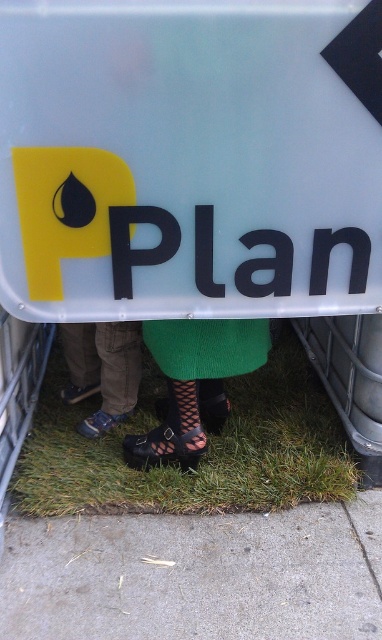
Question: Estimate the real-world distances between objects in this image. Which object is closer to the green grass at lower center?

Choices:
 (A) matte plastic sign at upper center
 (B) brown suede shoes at lower left
 (C) black leather shoes at center

Answer: (C)

Question: Which point is closer to the camera?

Choices:
 (A) (189, 420)
 (B) (55, 384)
 (C) (22, 51)
 (D) (114, 355)

Answer: (C)

Question: Is green grass at lower center wider than black leather shoes at center?

Choices:
 (A) yes
 (B) no

Answer: (A)

Question: Can you confirm if black leather shoes at center is positioned to the right of brown suede shoes at lower left?

Choices:
 (A) yes
 (B) no

Answer: (A)

Question: Estimate the real-world distances between objects in this image. Which object is farther from the brown suede shoes at lower left?

Choices:
 (A) green grass at lower center
 (B) matte plastic sign at upper center
 (C) black leather shoes at center

Answer: (B)

Question: Does black leather shoes at center appear on the right side of brown suede shoes at lower left?

Choices:
 (A) yes
 (B) no

Answer: (A)